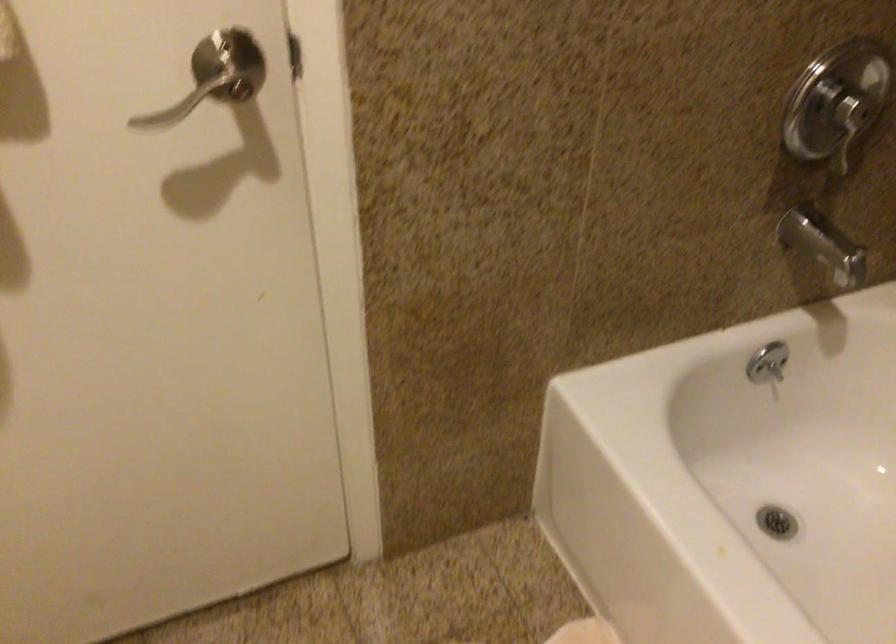
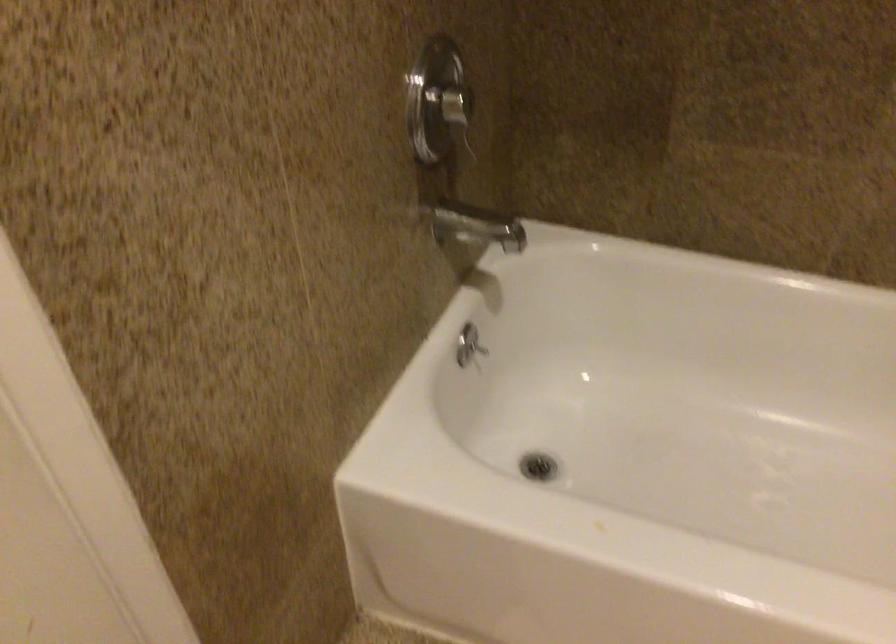
Question: The camera is either moving clockwise (left) or counter-clockwise (right) around the object. The first image is from the beginning of the video and the second image is from the end. Is the camera moving left or right when shooting the video?

Choices:
 (A) Left
 (B) Right

Answer: (A)